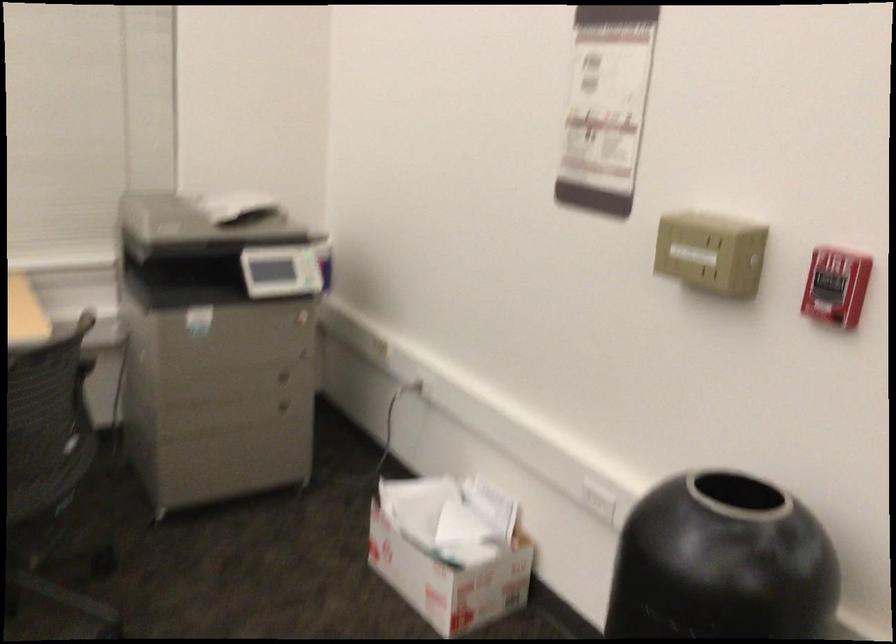
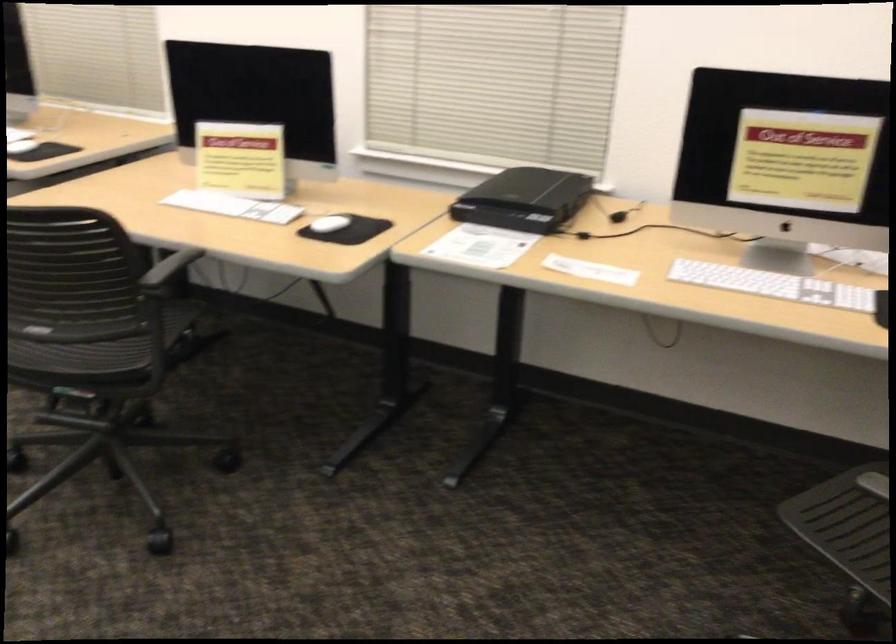
Question: How did the camera likely rotate?

Choices:
 (A) Left
 (B) Right
 (C) Up
 (D) Down

Answer: (A)